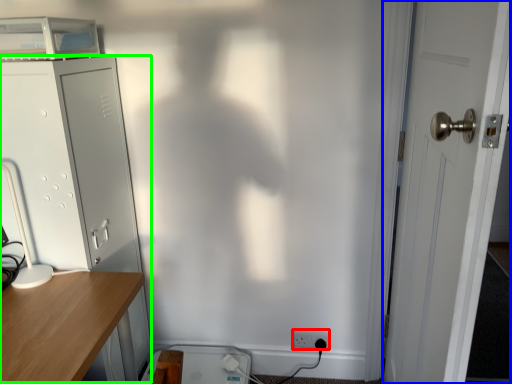
Question: Estimate the real-world distances between objects in this image. Which object is closer to electric outlet (highlighted by a red box), door (highlighted by a blue box) or file cabinet (highlighted by a green box)?

Choices:
 (A) door
 (B) file cabinet

Answer: (A)